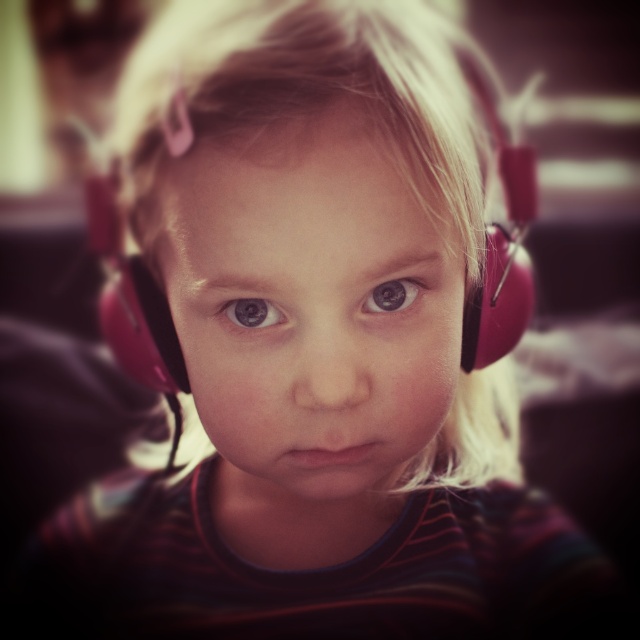
You are a photographer checking the alignment of eyes in a portrait. You notice the blue matte eye at center and the brown matte eye at center. Which eye is positioned to the left?

The blue matte eye at center is positioned to the left of the brown matte eye at center, so the blue matte eye at center is the one on the left side.

You are a photographer trying to adjust the focus of your camera. You have two points in the image to focus on, point 1 at point 1 at point (259,320) and point 2 at point (394,301). Which point is closer to the camera and should be focused on first?

Point 1 at point (259,320) is closer to the viewer than point 2 at point (394,301), so you should focus on point 1 at point (259,320) first.

You are a photographer adjusting the lighting for a portrait. You notice the blue matte eye at center and the brown matte eye at center in the image. Which eye is positioned lower on the subject?

The blue matte eye at center is located below the brown matte eye at center, so the blue one is lower.